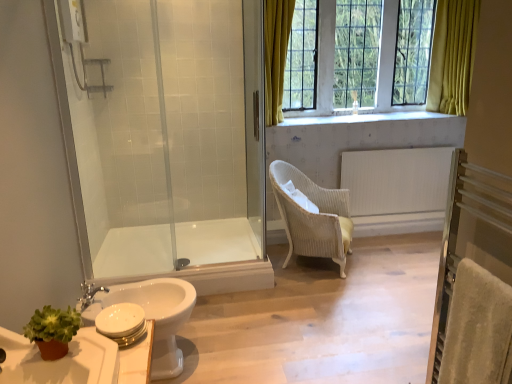
Find the location of a particular element. This screenshot has width=512, height=384. free spot above white glossy bathtub at center (from a real-world perspective) is located at coordinates (169, 241).